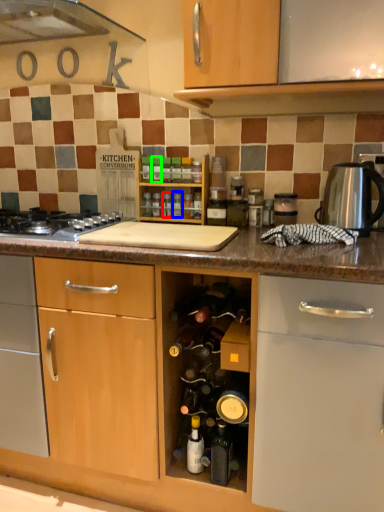
Question: Based on their relative distances, which object is farther from bottle (highlighted by a red box)? Choose from bottle (highlighted by a blue box) and bottle (highlighted by a green box).

Choices:
 (A) bottle
 (B) bottle

Answer: (B)